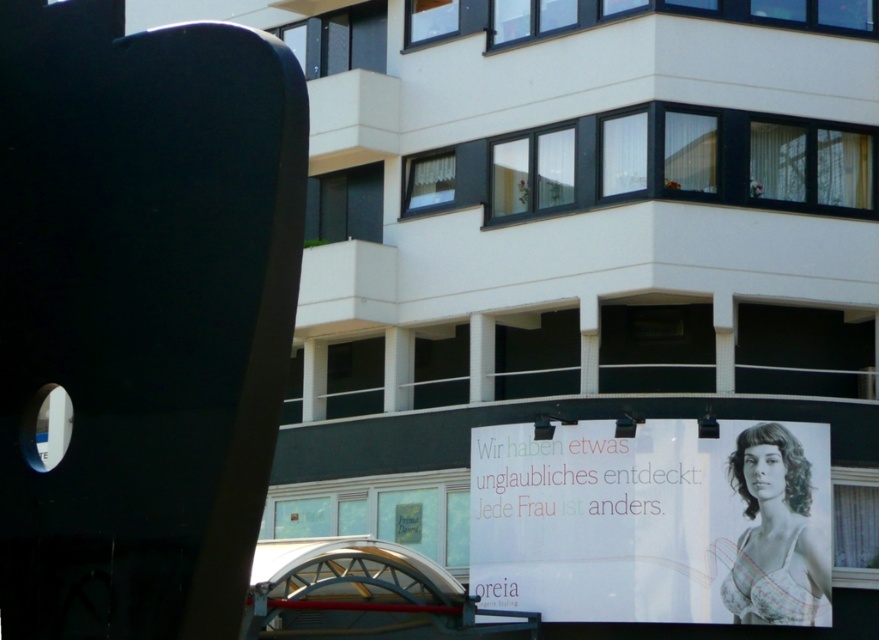
Is white paper poster at lower right positioned at the back of matte black bra at center?

Yes.

Which is above, white paper poster at lower right or matte black bra at center?

matte black bra at center is above.

The width and height of the screenshot is (879, 640). Find the location of `white paper poster at lower right`. white paper poster at lower right is located at coordinates (652, 522).